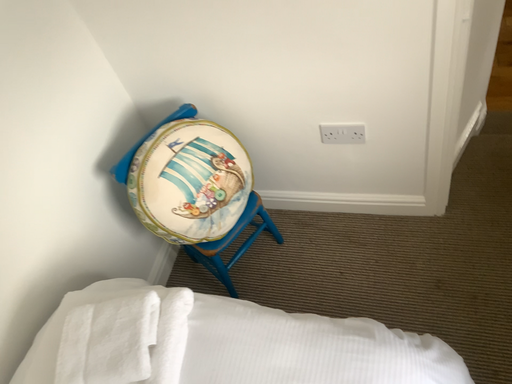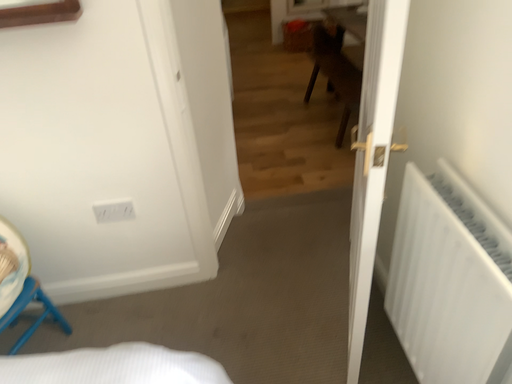
Question: How did the camera likely rotate when shooting the video?

Choices:
 (A) rotated downward
 (B) rotated upward

Answer: (B)